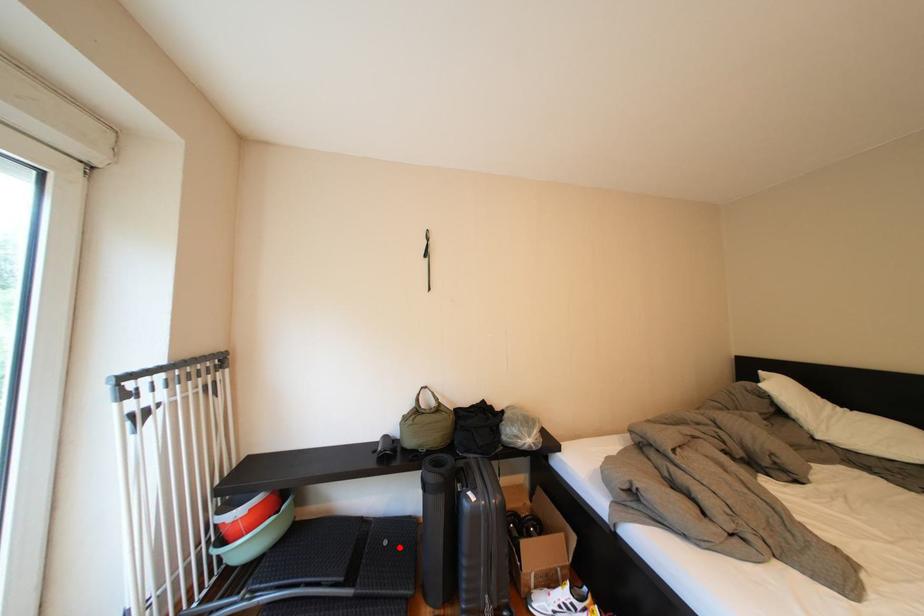
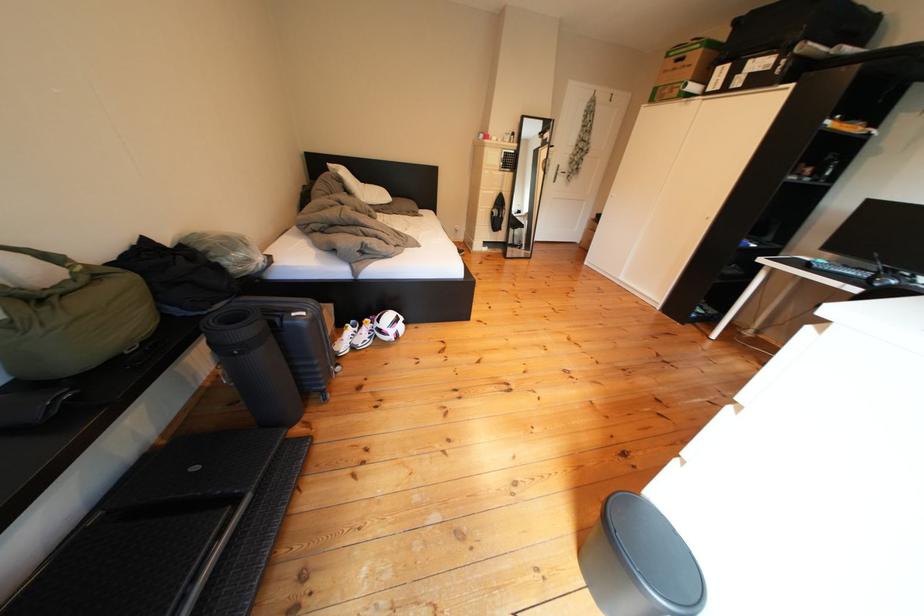
Find the pixel in the second image that matches the highlighted location in the first image.

(209, 474)